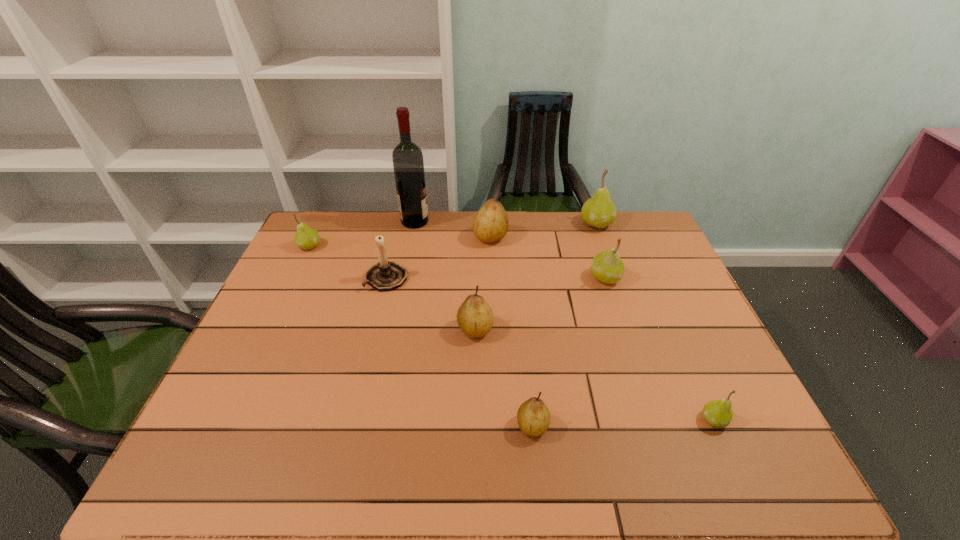
Locate an element on the screen. The image size is (960, 540). free space between the smallest brown pear and the farthest brown pear is located at coordinates (512, 332).

In order to click on free point between the leftmost pear and the nearest brown pear in this screenshot , I will do [421, 336].

The height and width of the screenshot is (540, 960). I want to click on vacant space that's between the third nearest pear and the eighth shortest object, so click(x=536, y=276).

You are a GUI agent. You are given a task and a screenshot of the screen. Output one action in this format:
    pyautogui.click(x=<x>, y=<y>)
    Task: Click on the vacant area between the farthest brown pear and the biggest green pear
    
    Given the screenshot: What is the action you would take?
    pyautogui.click(x=543, y=231)

The height and width of the screenshot is (540, 960). What are the coordinates of `free area in between the candle holder and the biggest brown pear` in the screenshot? It's located at coord(439,258).

Locate which object is the third closest to the brown candle holder. Please provide its 2D coordinates. Your answer should be formatted as a tuple, i.e. [(x, y)], where the tuple contains the x and y coordinates of a point satisfying the conditions above.

[(408, 164)]

This screenshot has height=540, width=960. I want to click on object that is the third closest to the nearest brown pear, so click(607, 267).

Image resolution: width=960 pixels, height=540 pixels. In order to click on the fourth closest pear relative to the third smallest green pear in this screenshot , I will do `click(718, 413)`.

Where is `pear that is the sixth closest to the tallest pear`? The height and width of the screenshot is (540, 960). pear that is the sixth closest to the tallest pear is located at coordinates (306, 238).

In order to click on green pear that stands as the second closest to the candle holder in this screenshot , I will do `click(607, 267)`.